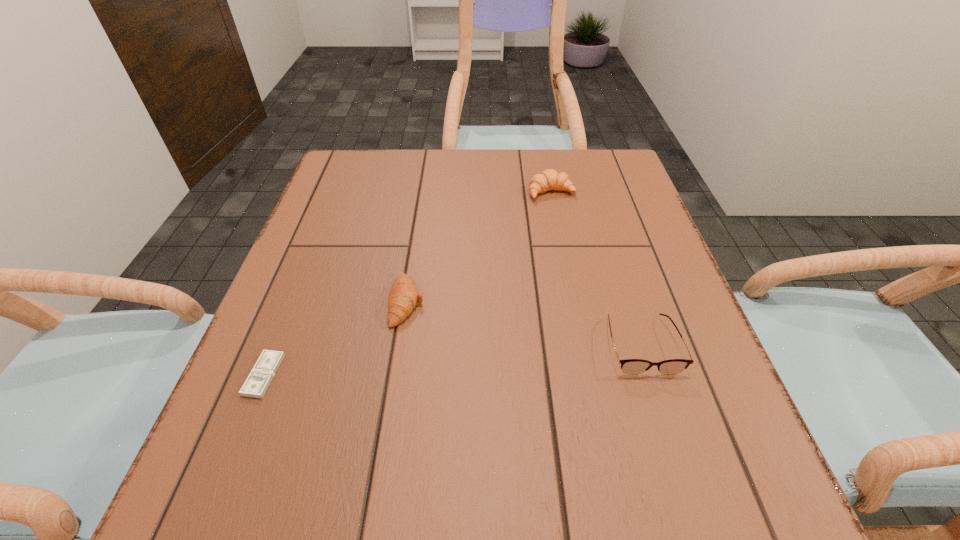
The width and height of the screenshot is (960, 540). In the image, there is a desktop. What are the coordinates of `free space at the near left corner` in the screenshot? It's located at (285, 522).

The width and height of the screenshot is (960, 540). In order to click on free space at the far right corner in this screenshot , I will do `click(609, 156)`.

Find the location of a particular element. vacant space at the near right corner is located at coordinates (726, 536).

Identify the location of empty space that is in between the left crescent roll and the shortest object. The height and width of the screenshot is (540, 960). (336, 339).

Find the location of `blank region between the money and the spectacles`. blank region between the money and the spectacles is located at coordinates point(452,360).

I want to click on empty space that is in between the spectacles and the farther crescent roll, so click(x=596, y=268).

Locate an element on the screen. The width and height of the screenshot is (960, 540). unoccupied area between the spectacles and the leftmost object is located at coordinates (452, 360).

The image size is (960, 540). I want to click on unoccupied area between the nearer crescent roll and the money, so click(336, 339).

Locate an element on the screen. Image resolution: width=960 pixels, height=540 pixels. free spot between the spectacles and the leftmost object is located at coordinates (452, 360).

You are a GUI agent. You are given a task and a screenshot of the screen. Output one action in this format:
    pyautogui.click(x=<x>, y=<y>)
    Task: Click on the vacant space that's between the shorter crescent roll and the spectacles
    
    Given the screenshot: What is the action you would take?
    pyautogui.click(x=524, y=323)